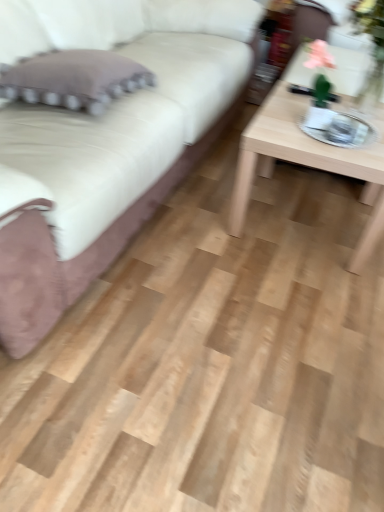
Question: Considering their positions, is velvet beige couch at upper left located in front of or behind purple fabric pillow at left?

Choices:
 (A) front
 (B) behind

Answer: (A)

Question: From the image's perspective, is velvet beige couch at upper left located above or below purple fabric pillow at left?

Choices:
 (A) below
 (B) above

Answer: (B)

Question: Which is farther from the light wood/texture coffee table at right?

Choices:
 (A) purple fabric pillow at left
 (B) velvet beige couch at upper left

Answer: (A)

Question: Which object is positioned closest to the light wood/texture coffee table at right?

Choices:
 (A) velvet beige couch at upper left
 (B) purple fabric pillow at left

Answer: (A)